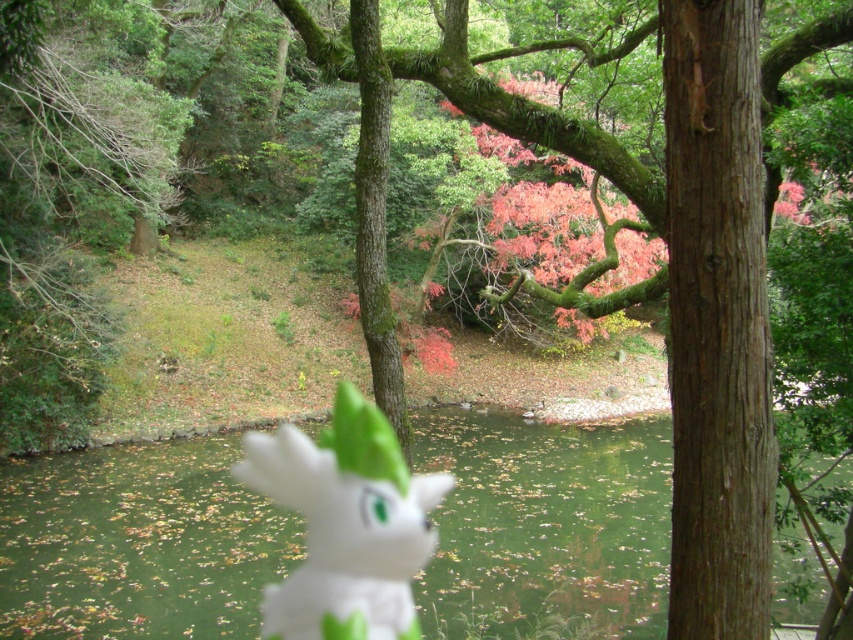
In the scene shown: You are a photographer trying to capture a closeup shot of the white matte plush at center. The camera you are using has a minimum focusing distance of 5 meters. Will you be able to take the photo without moving the plush?

The white matte plush at center is 4.73 meters from camera. Since the minimum focusing distance is 5 meters, the camera cannot focus on the plush at this distance. You will need to move the plush further away or use a different camera with a shorter minimum focusing distance.

You are a photographer who wants to capture a closeup of the white matte plush at center without the green matte lake at center appearing in the frame. Is this possible given their sizes?

The green matte lake at center is smaller than the white matte plush at center. Since the lake is smaller, it might be possible to frame the plush without the lake if positioned correctly, but their sizes alone don not guarantee this. Other factors like distance and camera angle would also play a role.

Looking at this image, you are a photographer trying to capture a reflection of the autumn tree in the water. You have a white matte plush at center and a green matte lake at center. Which object should you focus on to ensure the reflection is clear?

The green matte lake at center is positioned on the right side of white matte plush at center. To capture the reflection of the autumn tree, focus on the green matte lake at center since it is the water surface where reflections would naturally occur.